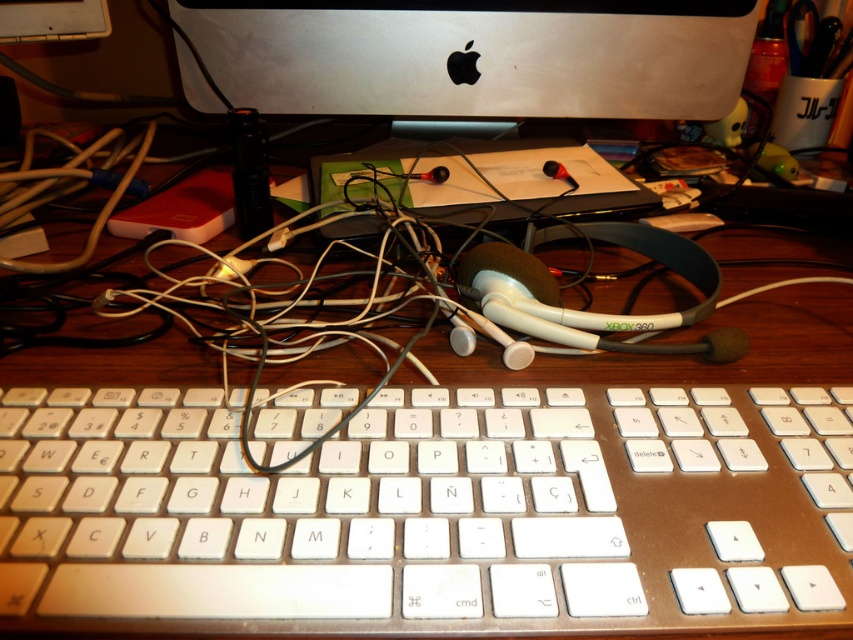
Looking at this image, you are a delivery person who just arrived at the office to drop off a package. You need to place the package on the desk without blocking the keyboard. The desk has a coordinate system where the bottom left corner is the origin. The keyboard is at point [430,513]. Where should you place the package?

The white plastic keyboard at center is located at point [430,513]. To avoid blocking it, place the package away from this coordinate.

You need to place a 12 inch wide laptop between the white plastic keyboard at center and the sleek silver monitor at upper center. Is there enough space?

The white plastic keyboard at center is narrower than the sleek silver monitor at upper center, but the exact width of the space between them isn

You need to place a new wireless mouse on the desk. Considering the white plastic keyboard at center and the sleek silver monitor at upper center, which object should you move to make space for the mouse?

Since the white plastic keyboard at center occupies less space than the sleek silver monitor at upper center, you should move the sleek silver monitor at upper center to create more space for the wireless mouse.